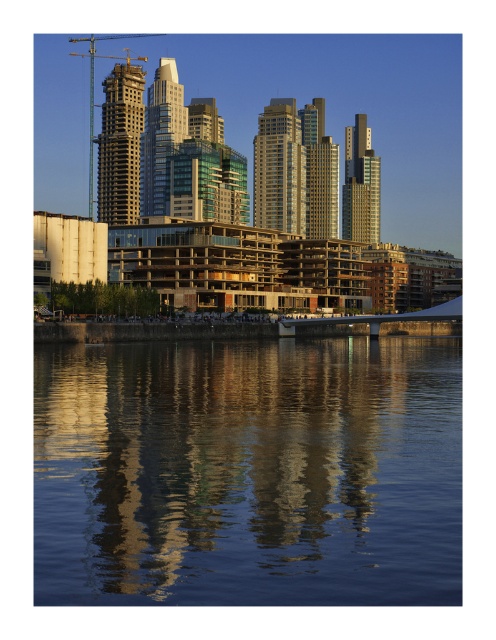
Consider the image. You are standing at the waterfront in the image and want to reach a specific point marked at coordinates point (271, 120). If you start walking straight ahead, will you reach this point before walking 300 meters?

The point (271, 120) is 257.88 meters away from the viewer. Since this distance is less than 300 meters, you will reach the point before walking 300 meters.

You are a city planner reviewing this urban layout. You notice a point at coordinates (319, 172). What does this point represent in the scene?

The point at coordinates (319, 172) indicates the gold glass skyscraper at center.

You are a drone operator trying to navigate between two points in the urban waterfront scene. You need to fly from point A to point B. Given that point A is at coordinates point [267,208] and point B is at coordinates point [153,131], which point is closer to the observer based on their spatial relationship?

Point [267,208] is in front of point [153,131], so it is closer to the observer.